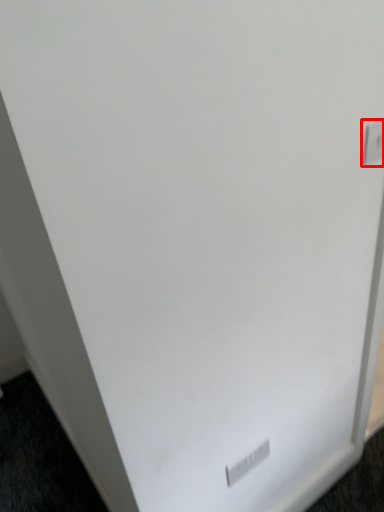
Question: Where is electric outlet (annotated by the red box) located in relation to electric outlet in the image?

Choices:
 (A) left
 (B) right

Answer: (B)